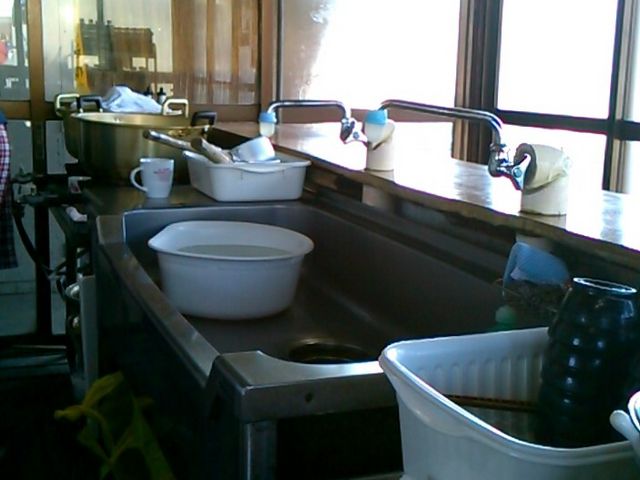
In order to click on steel metal leg in this screenshot , I will do `click(260, 461)`.